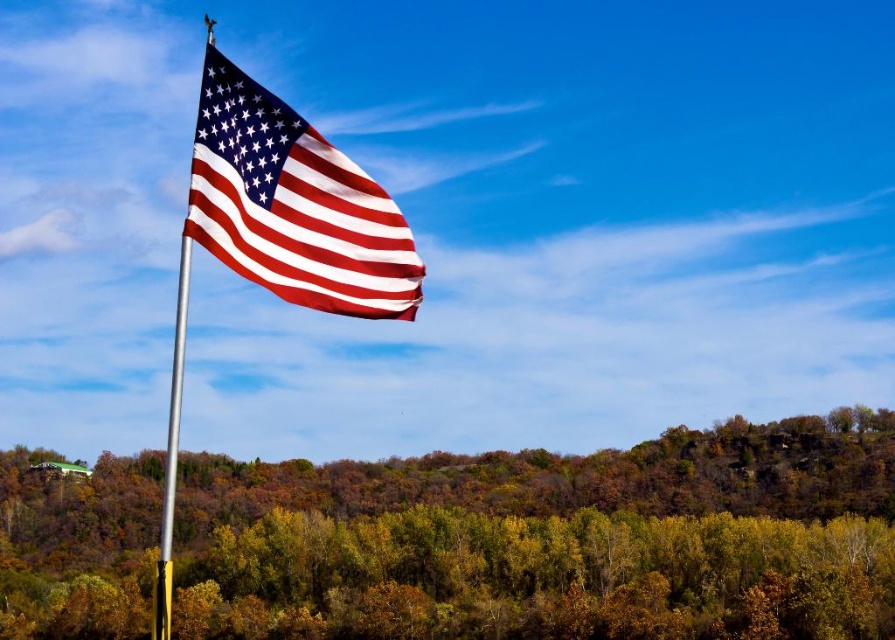
Describe the element at coordinates (551, 540) in the screenshot. I see `green leafy tree at center` at that location.

How much distance is there between green leafy tree at center and matte fabric flag at upper left?

green leafy tree at center is 171.86 meters away from matte fabric flag at upper left.

Who is more forward, [831,515] or [219,252]?

Point [219,252]

The width and height of the screenshot is (895, 640). In order to click on green leafy tree at center in this screenshot , I will do `click(551, 540)`.

From the picture: Does green leafy tree at center lie behind silver metallic pole at left?

That is True.

Between green leafy tree at center and silver metallic pole at left, which one is positioned higher?

Positioned higher is silver metallic pole at left.

Identify the location of green leafy tree at center. Image resolution: width=895 pixels, height=640 pixels. (551, 540).

Does matte fabric flag at upper left have a greater width compared to silver metallic pole at left?

Incorrect, matte fabric flag at upper left's width does not surpass silver metallic pole at left's.

Which is more to the right, matte fabric flag at upper left or silver metallic pole at left?

From the viewer's perspective, matte fabric flag at upper left appears more on the right side.

Where is `matte fabric flag at upper left`? This screenshot has width=895, height=640. matte fabric flag at upper left is located at coordinates (293, 205).

Image resolution: width=895 pixels, height=640 pixels. I want to click on matte fabric flag at upper left, so click(293, 205).